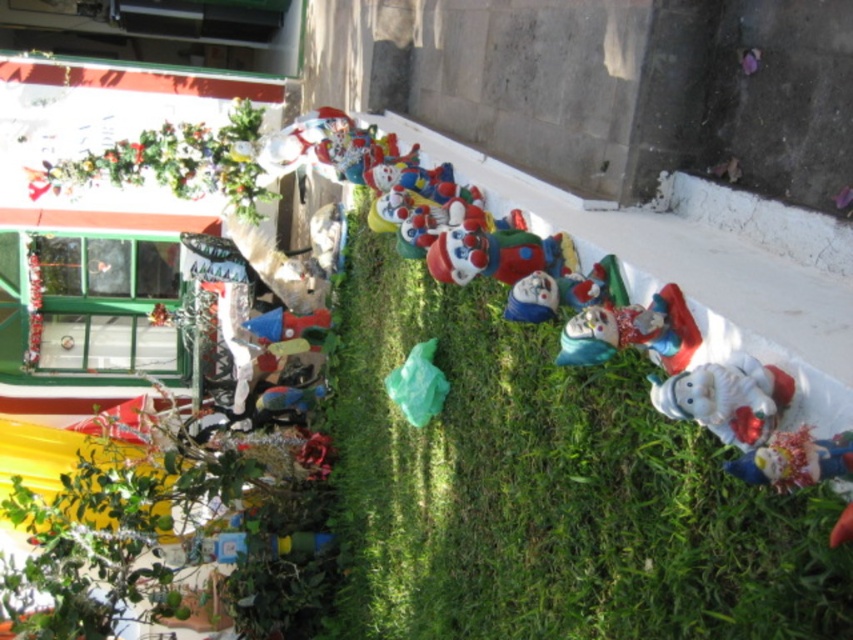
Who is positioned more to the right, white glossy santa at lower right or shiny metallic clown at lower right?

Positioned to the right is shiny metallic clown at lower right.

Can you confirm if white glossy santa at lower right is thinner than shiny metallic clown at lower right?

Incorrect, white glossy santa at lower right's width is not less than shiny metallic clown at lower right's.

Find the location of a particular element. Image resolution: width=853 pixels, height=640 pixels. white glossy santa at lower right is located at coordinates (726, 397).

Locate an element on the screen. The width and height of the screenshot is (853, 640). green grass at center is located at coordinates (547, 490).

Who is lower down, green grass at center or matte plastic clown at center?

green grass at center

The image size is (853, 640). What are the coordinates of `green grass at center` in the screenshot? It's located at (547, 490).

Based on the photo, which is more to the left, matte plastic clown at center or shiny metallic clown at lower right?

matte plastic clown at center is more to the left.

Can you confirm if matte plastic clown at center is positioned to the right of shiny metallic clown at lower right?

In fact, matte plastic clown at center is to the left of shiny metallic clown at lower right.

Who is more distant from viewer, (636, 336) or (842, 460)?

Point (636, 336)

Where is `matte plastic clown at center`? Image resolution: width=853 pixels, height=640 pixels. matte plastic clown at center is located at coordinates (633, 332).